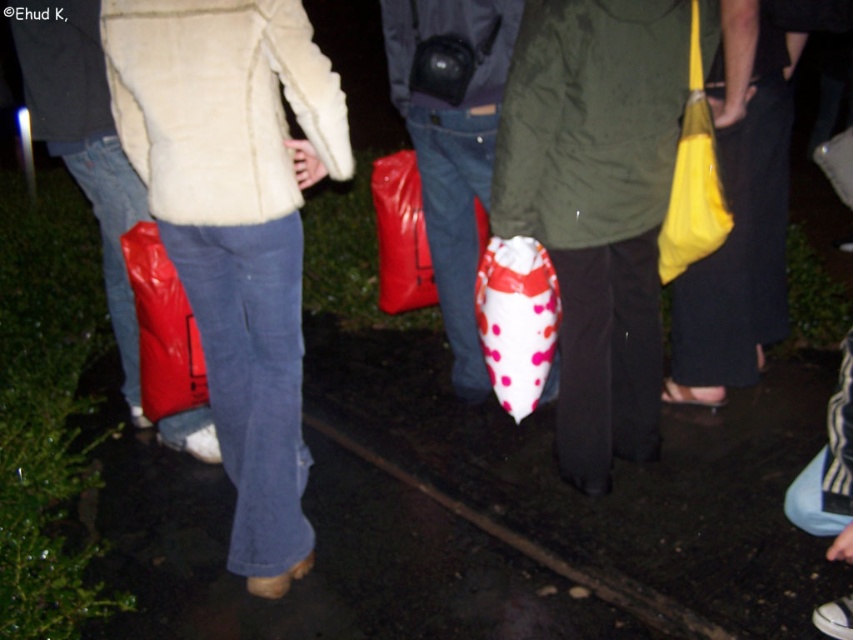
In the scene shown: You are a photographer standing in front of the group. You want to take a photo that includes both the matte white jacket at center and the matte black bag at center. Which object will appear larger in your photo?

The matte white jacket at center will appear larger in the photo because it is closer to the viewer than the matte black bag at center.

You are a photographer trying to capture the scene. You notice the matte blue jeans at left and the yellow fabric bag at right. Which object is closer to the camera based on their positions?

The matte blue jeans at left is positioned under the yellow fabric bag at right, meaning it is closer to the camera.

You are a photographer trying to capture the scene. The matte blue jeans at left and the matte red plastic bag at lower left are in your frame. Which object should you focus on if you want to capture the wider object in your photo?

The matte blue jeans at left is wider than the matte red plastic bag at lower left, so you should focus on the matte blue jeans at left to capture the wider object.